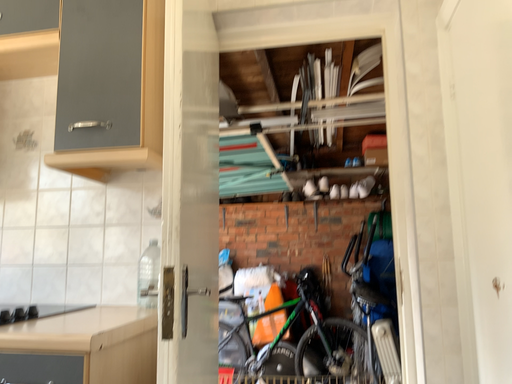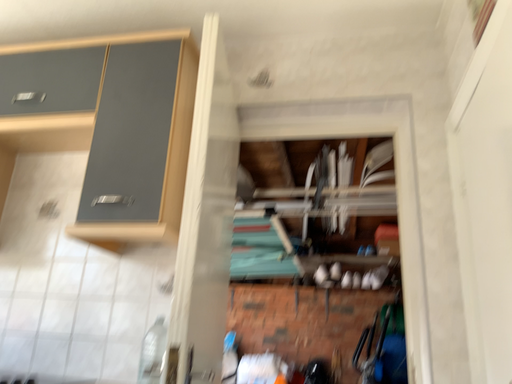
Question: How did the camera likely rotate when shooting the video?

Choices:
 (A) rotated upward
 (B) rotated downward

Answer: (A)